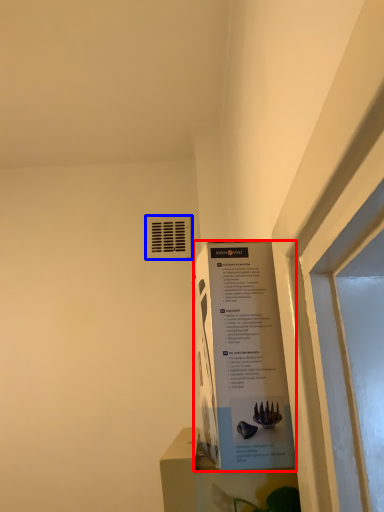
Question: Which of the following is the closest to the observer, poster (highlighted by a red box) or air conditioning (highlighted by a blue box)?

Choices:
 (A) poster
 (B) air conditioning

Answer: (A)